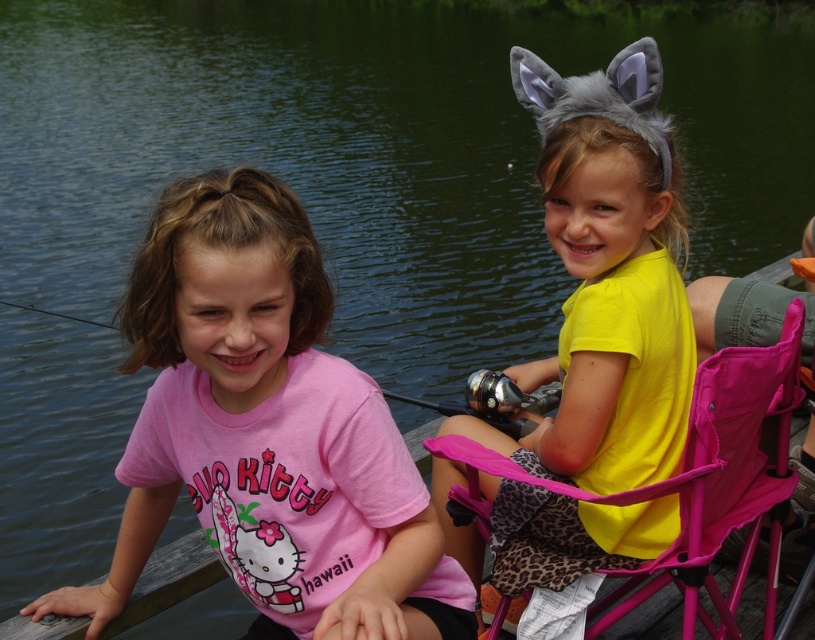
Question: Does pink matte shirt at left have a greater width compared to yellow matte shirt at center?

Choices:
 (A) yes
 (B) no

Answer: (A)

Question: Among these objects, which one is farthest from the camera?

Choices:
 (A) yellow matte shirt at center
 (B) pink matte shirt at left
 (C) pink fabric chair at right

Answer: (A)

Question: Which object is closer to the camera taking this photo?

Choices:
 (A) yellow matte shirt at center
 (B) pink fabric chair at right
 (C) pink matte shirt at left

Answer: (C)

Question: From the image, what is the correct spatial relationship of pink matte shirt at left in relation to yellow matte shirt at center?

Choices:
 (A) below
 (B) above

Answer: (A)

Question: Among these objects, which one is farthest from the camera?

Choices:
 (A) pink fabric chair at right
 (B) pink matte shirt at left
 (C) yellow matte shirt at center

Answer: (C)

Question: Is yellow matte shirt at center in front of pink fabric chair at right?

Choices:
 (A) yes
 (B) no

Answer: (B)